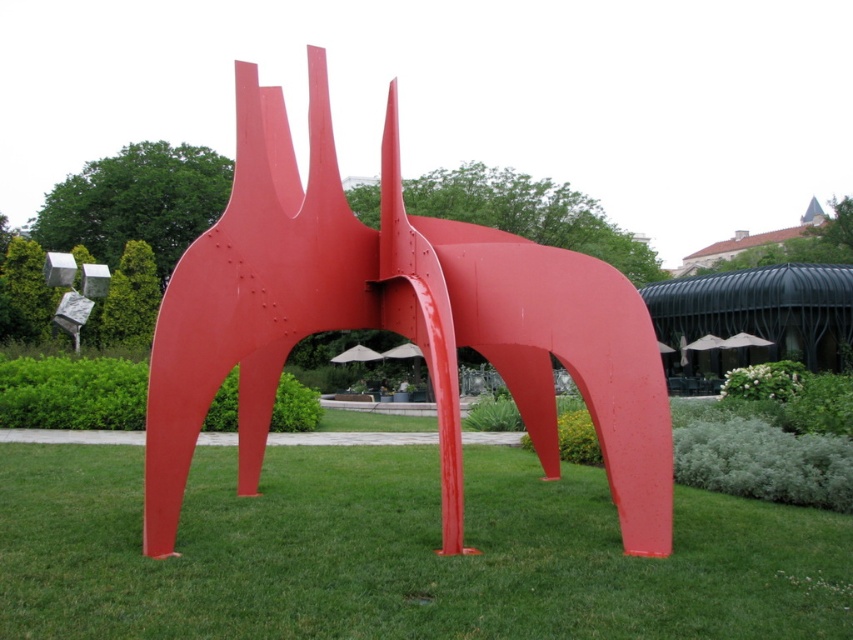
Is green grass at center positioned in front of glossy metal sculpture at center?

That is True.

Who is more distant from viewer, (125, 483) or (256, 156)?

The point (125, 483) is behind.

Between point (12, 454) and point (540, 310), which one is positioned in front?

Point (540, 310) is more forward.

Find the location of a particular element. Image resolution: width=853 pixels, height=640 pixels. green grass at center is located at coordinates (398, 552).